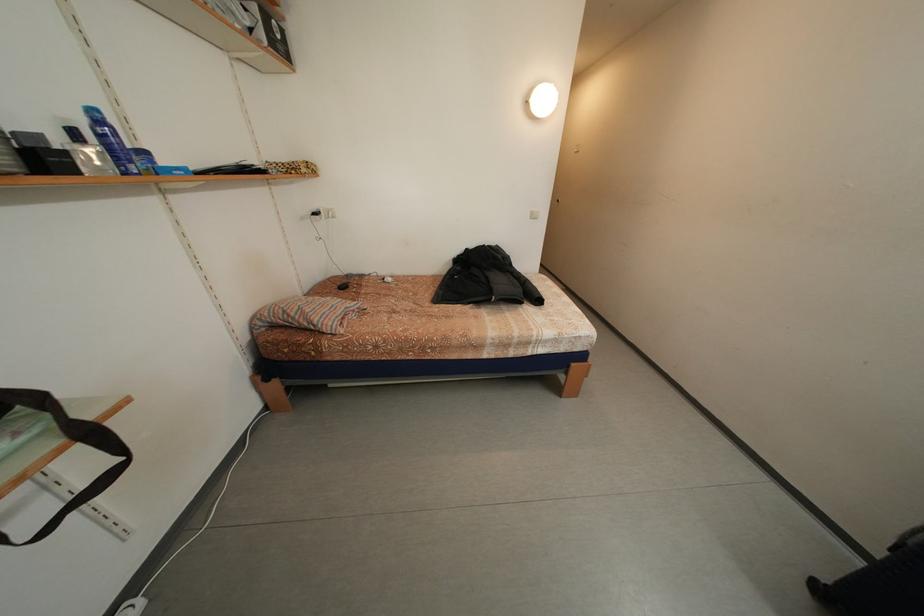
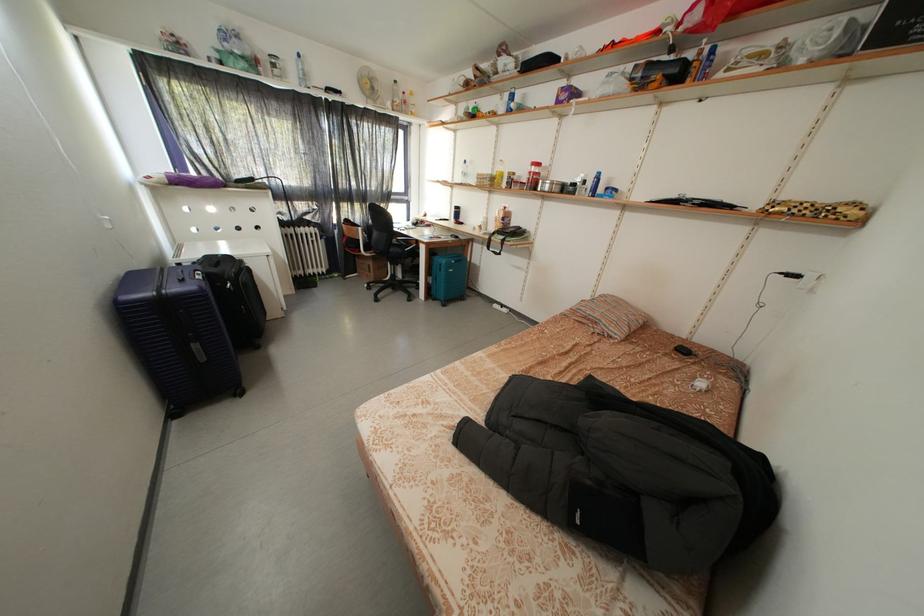
In the second image, find the point that corresponds to the point at 351,292 in the first image.

(691, 355)